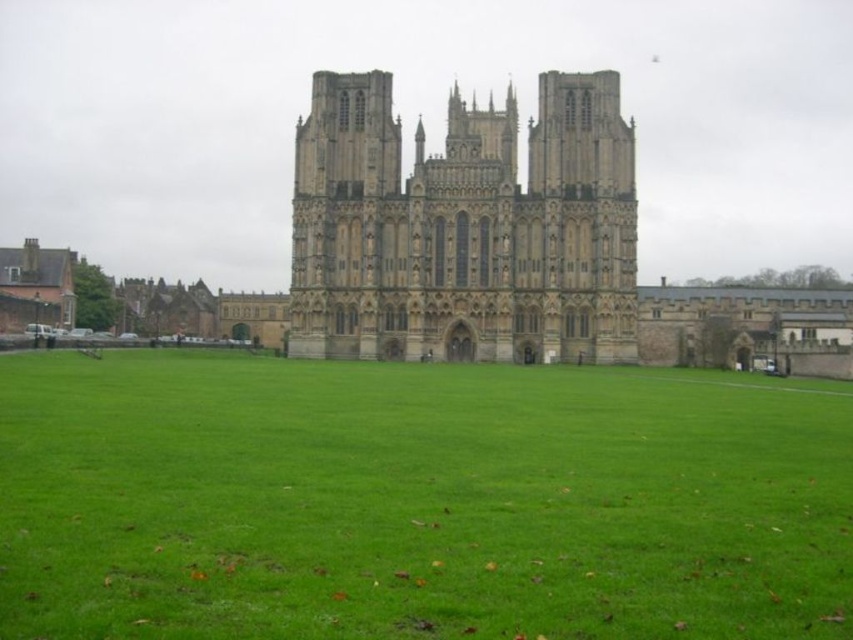
You are standing in a park and see the green grass at center and the stone gothic cathedral at center. Which object is located lower in the image?

The green grass at center is located lower in the image than the stone gothic cathedral at center.